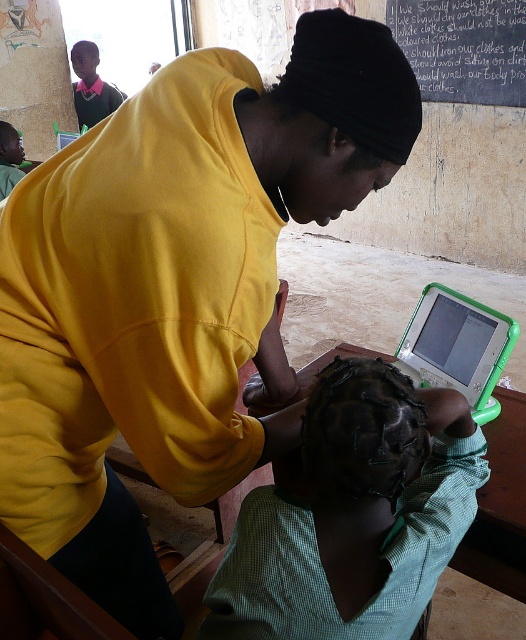
You are standing in the classroom and want to reach both points on the desk. Which point, point (419, 612) or point (450, 51), is closer to you?

Point (419, 612) is closer to the viewer than point (450, 51).

You are a teacher observing a classroom activity. You notice the green checkered shirt at lower center and the green plastic laptop at lower right. Which object is taller?

The green checkered shirt at lower center is taller than the green plastic laptop at lower right according to the description.

Looking at this image, you are a student who needs to take a photo of the point at coordinates (423,298) in the classroom. The camera you have is 1.5 meters in front of you. Can you take the photo without moving closer?

The point at coordinates (423,298) is 1.52 meters away from the camera. Since the camera is only 1.5 meters away from you, you are slightly too far to capture the point clearly. You should move about 2 centimeters closer to ensure the photo is in focus.